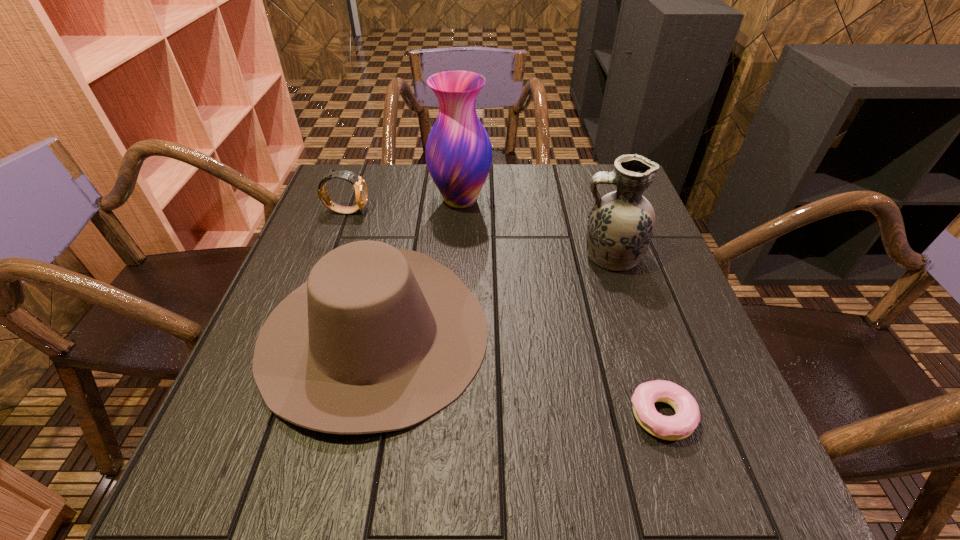
In order to click on the left vase in this screenshot , I will do pos(458,151).

Find the location of `the farther vase`. the farther vase is located at coordinates (458, 151).

Where is `the right vase`? the right vase is located at coordinates (621, 224).

What are the coordinates of `the nearer vase` in the screenshot? It's located at (621, 224).

You are a GUI agent. You are given a task and a screenshot of the screen. Output one action in this format:
    pyautogui.click(x=<x>, y=<y>)
    Task: Click on the cowboy hat
    
    Given the screenshot: What is the action you would take?
    pyautogui.click(x=378, y=339)

Where is `watch`? The image size is (960, 540). watch is located at coordinates (361, 193).

Identify the location of the shortest object. (681, 425).

The image size is (960, 540). I want to click on free region located 0.050m on the back of the left vase, so click(x=462, y=174).

I want to click on free space located 0.340m with the handle on the side of the shorter vase, so click(x=431, y=256).

Find the location of a particular element. vacant space located with the handle on the side of the shorter vase is located at coordinates (453, 256).